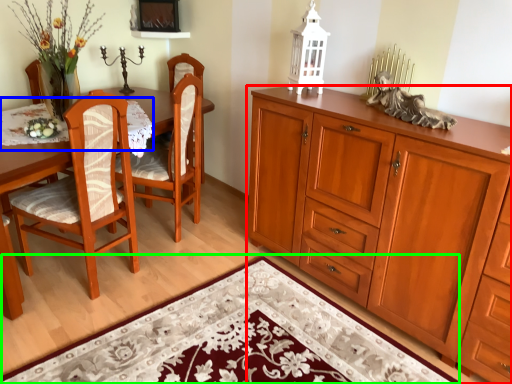
Question: Which object is positioned closest to cabinetry (highlighted by a red box)? Select from tablecloth (highlighted by a blue box) and doormat (highlighted by a green box).

Choices:
 (A) tablecloth
 (B) doormat

Answer: (B)